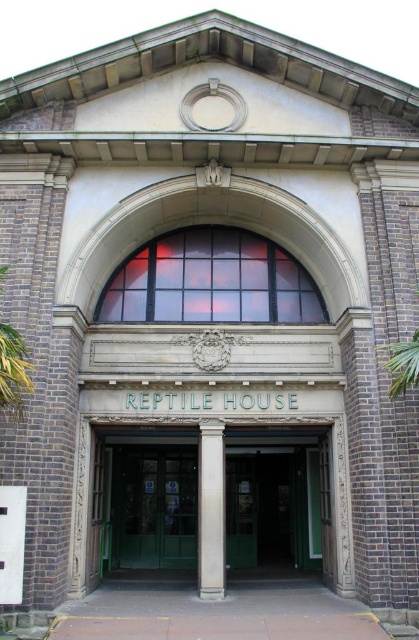
Question: Can you confirm if green glass door at center is thinner than white stone column at center?

Choices:
 (A) yes
 (B) no

Answer: (B)

Question: Does green glass door at center have a greater width compared to white stone column at center?

Choices:
 (A) yes
 (B) no

Answer: (A)

Question: Among these objects, which one is farthest from the camera?

Choices:
 (A) green glass door at center
 (B) white stone column at center

Answer: (A)

Question: Which of the following is the farthest from the observer?

Choices:
 (A) (147, 464)
 (B) (222, 481)

Answer: (A)

Question: Does green glass door at center have a larger size compared to white stone column at center?

Choices:
 (A) yes
 (B) no

Answer: (A)